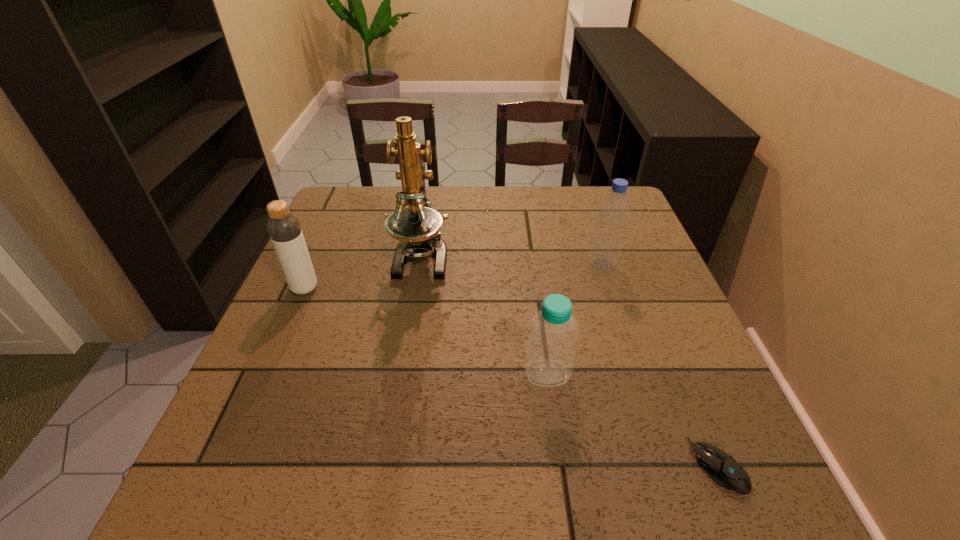
Where is `free area in between the second object from right to left and the second object from left to right`? The width and height of the screenshot is (960, 540). free area in between the second object from right to left and the second object from left to right is located at coordinates (512, 261).

Find the location of a particular element. vacant area that lies between the leftmost bottle and the shortest object is located at coordinates (512, 377).

Where is `free space between the fourth object from right to left and the second nearest bottle`? free space between the fourth object from right to left and the second nearest bottle is located at coordinates (363, 273).

Identify the location of object that ranks as the fourth closest to the leftmost bottle. Image resolution: width=960 pixels, height=540 pixels. (721, 467).

Locate an element on the screen. This screenshot has width=960, height=540. object identified as the fourth closest to the second bottle from left to right is located at coordinates (284, 229).

What are the coordinates of `bottle that is the closest one to the rightmost object` in the screenshot? It's located at (549, 357).

Image resolution: width=960 pixels, height=540 pixels. In order to click on bottle object that ranks as the second closest to the microscope in this screenshot , I will do `click(549, 357)`.

The height and width of the screenshot is (540, 960). What are the coordinates of `free region that satisfies the following two spatial constraints: 1. at the eyepiece of the tallest object; 2. on the right side of the rightmost object` in the screenshot? It's located at (388, 466).

The height and width of the screenshot is (540, 960). Identify the location of vacant space that satisfies the following two spatial constraints: 1. at the eyepiece of the rightmost bottle; 2. on the left side of the tallest object. click(420, 266).

You are a GUI agent. You are given a task and a screenshot of the screen. Output one action in this format:
    pyautogui.click(x=<x>, y=<y>)
    Task: Click on the vacant space that satisfies the following two spatial constraints: 1. on the front side of the shortest bottle; 2. on the left side of the computer mouse
    Image resolution: width=960 pixels, height=540 pixels.
    Given the screenshot: What is the action you would take?
    pyautogui.click(x=560, y=466)